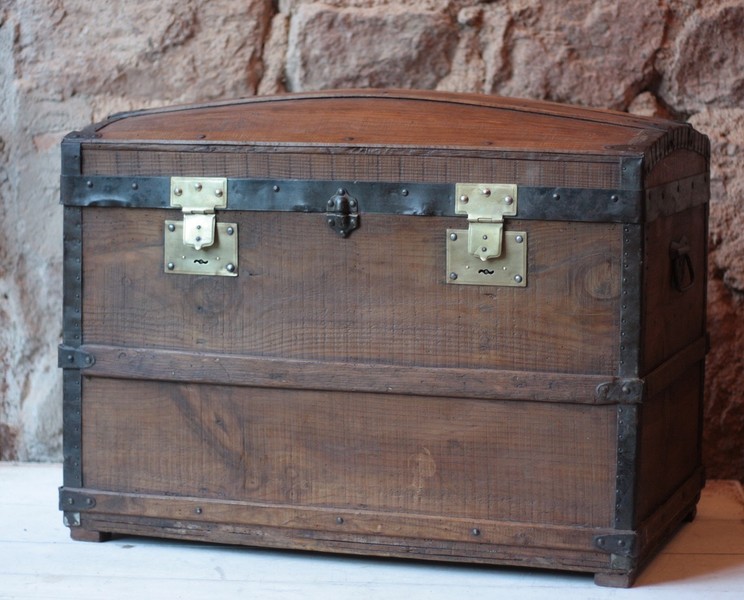
This screenshot has width=744, height=600. In order to click on metal frame in this screenshot , I will do `click(288, 193)`, `click(77, 263)`, `click(626, 272)`.